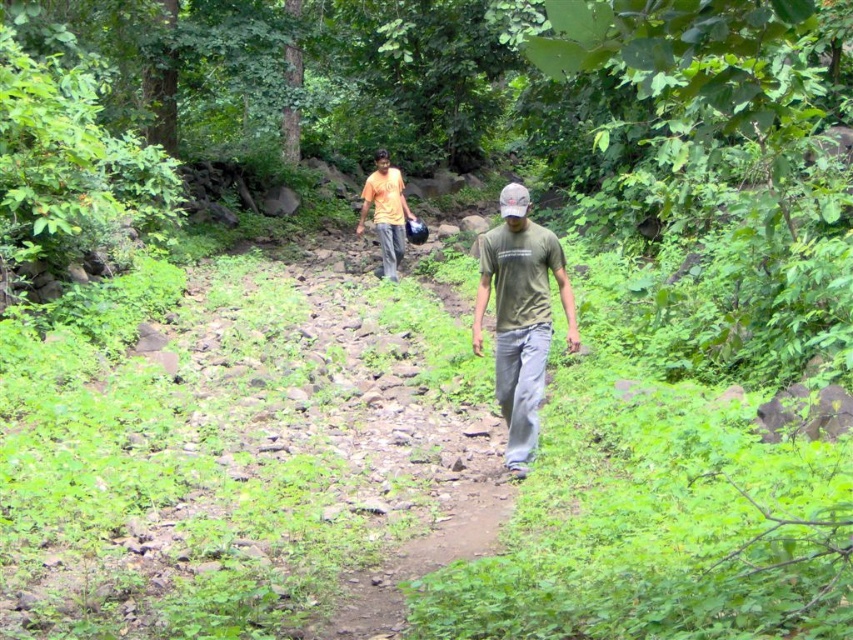
Question: Considering the relative positions of green matte t-shirt at center and orange matte shirt at center in the image provided, where is green matte t-shirt at center located with respect to orange matte shirt at center?

Choices:
 (A) above
 (B) below

Answer: (B)

Question: Which point is farther from the camera taking this photo?

Choices:
 (A) (401, 204)
 (B) (527, 292)

Answer: (A)

Question: Where is green matte t-shirt at center located in relation to orange matte shirt at center in the image?

Choices:
 (A) right
 (B) left

Answer: (A)

Question: Which point is farther from the camera taking this photo?

Choices:
 (A) (393, 212)
 (B) (503, 321)

Answer: (A)

Question: In this image, where is green matte t-shirt at center located relative to orange matte shirt at center?

Choices:
 (A) right
 (B) left

Answer: (A)